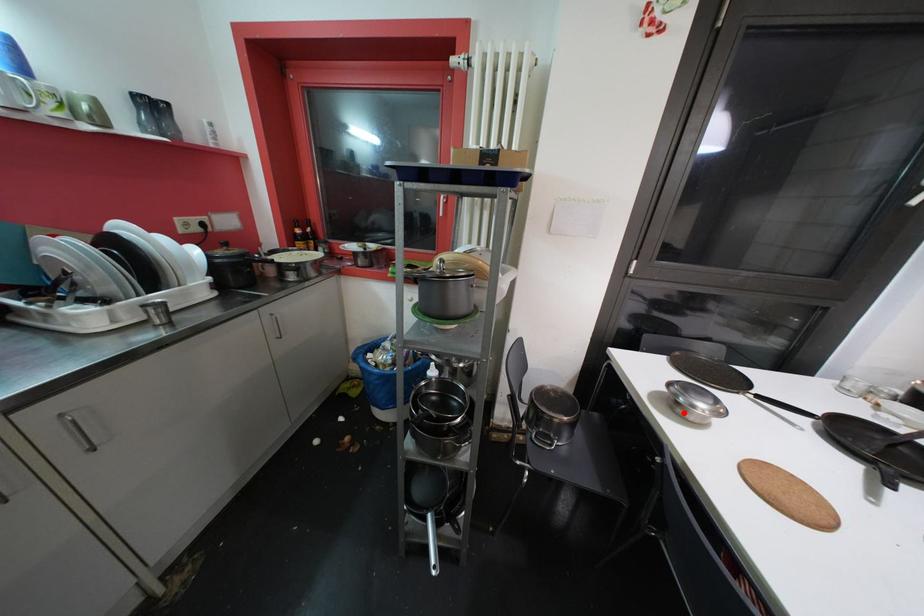
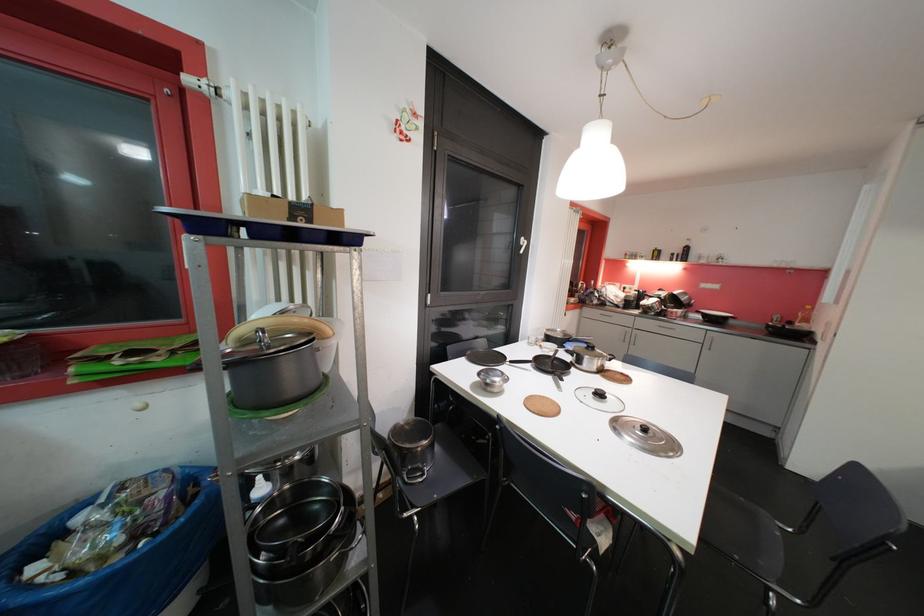
In the second image, find the point that corresponds to the highlighted location in the first image.

(493, 392)